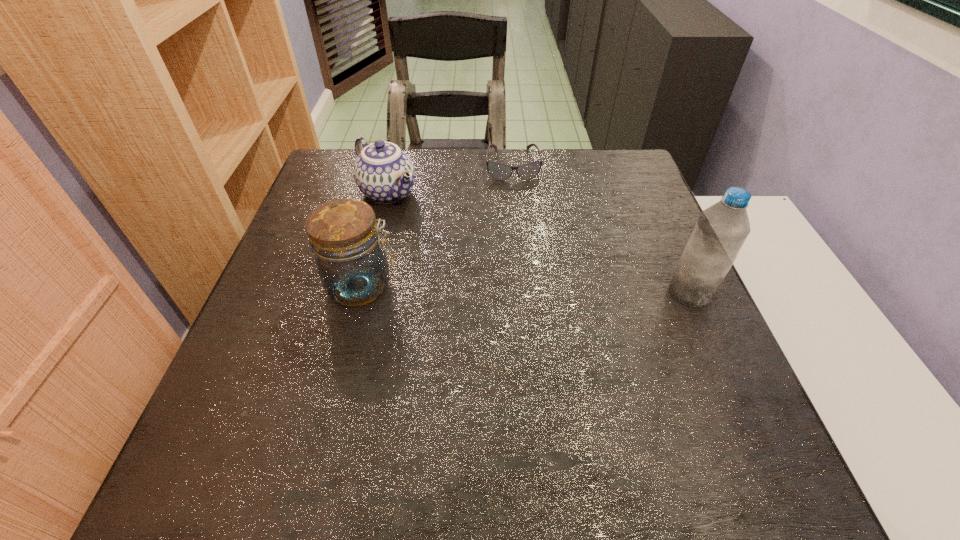
I want to click on blank space located 0.390m on the lenses of the second object from right to left, so tap(527, 287).

Find the location of a particular element. This screenshot has height=540, width=960. free location located from the spout of the third tallest object is located at coordinates (416, 219).

Identify the location of free space located 0.240m from the spout of the third tallest object. (463, 260).

Locate an element on the screen. The height and width of the screenshot is (540, 960). vacant space situated from the spout of the third tallest object is located at coordinates (442, 242).

I want to click on sunglasses positioned at the far edge, so click(x=500, y=171).

The width and height of the screenshot is (960, 540). I want to click on chinaware positioned at the far edge, so click(x=383, y=172).

Where is `jar situated at the left edge`? The height and width of the screenshot is (540, 960). jar situated at the left edge is located at coordinates (343, 234).

The width and height of the screenshot is (960, 540). What are the coordinates of `chinaware situated at the left edge` in the screenshot? It's located at (383, 172).

At what (x,y) coordinates should I click in order to perform the action: click on object situated at the right edge. Please return your answer as a coordinate pair (x, y). Looking at the image, I should click on (721, 230).

I want to click on object that is at the far left corner, so click(x=383, y=172).